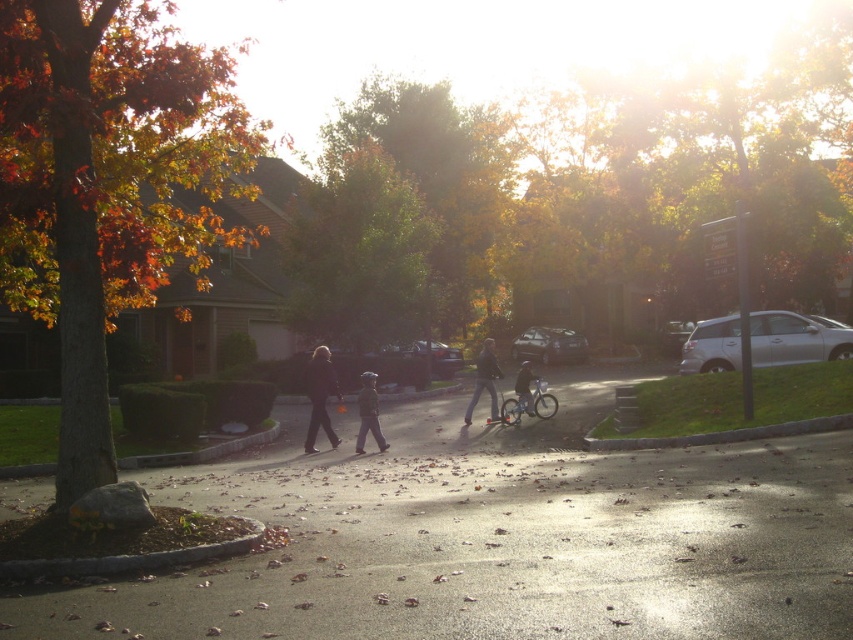
Question: Which is nearer to the dark matte jacket at center?

Choices:
 (A) autumn leaves at left
 (B) matte black bicycle at center
 (C) green leafy tree at center
 (D) matte black jacket at center

Answer: (D)

Question: From the image, what is the correct spatial relationship of smooth asphalt road at center in relation to dark blue jeans at center?

Choices:
 (A) left
 (B) right

Answer: (A)

Question: Is autumn leaves at left thinner than dark blue jeans at center?

Choices:
 (A) yes
 (B) no

Answer: (B)

Question: Does autumn leaves at left have a lesser width compared to matte black bicycle at center?

Choices:
 (A) yes
 (B) no

Answer: (B)

Question: Which of the following is the farthest from the observer?

Choices:
 (A) dark blue jeans at center
 (B) dark matte jacket at center
 (C) smooth asphalt road at center
 (D) matte black jacket at center

Answer: (A)

Question: Which point is farther from the camera taking this photo?

Choices:
 (A) (521, 406)
 (B) (480, 372)
 (C) (332, 433)
 (D) (363, 381)

Answer: (B)